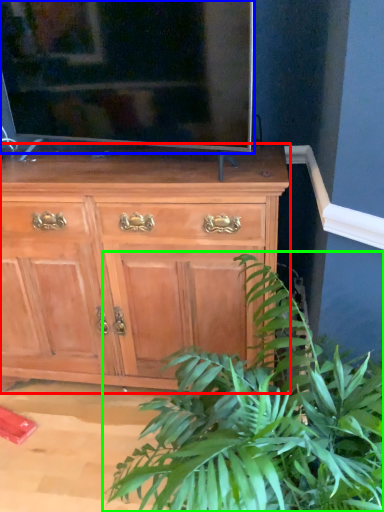
Question: Which object is positioned closest to chest of drawers (highlighted by a red box)? Select from television (highlighted by a blue box) and houseplant (highlighted by a green box).

Choices:
 (A) television
 (B) houseplant

Answer: (A)